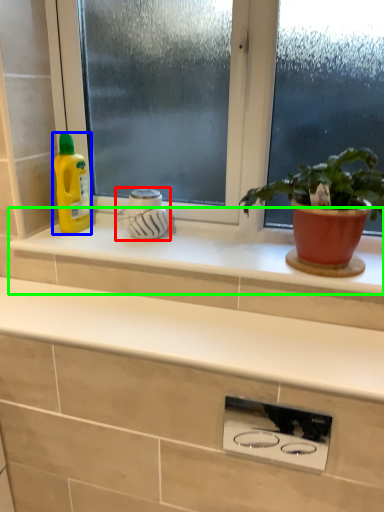
Question: Based on their relative distances, which object is nearer to appliance (highlighted by a red box)? Choose from cleaning product (highlighted by a blue box) and window sill (highlighted by a green box).

Choices:
 (A) cleaning product
 (B) window sill

Answer: (B)